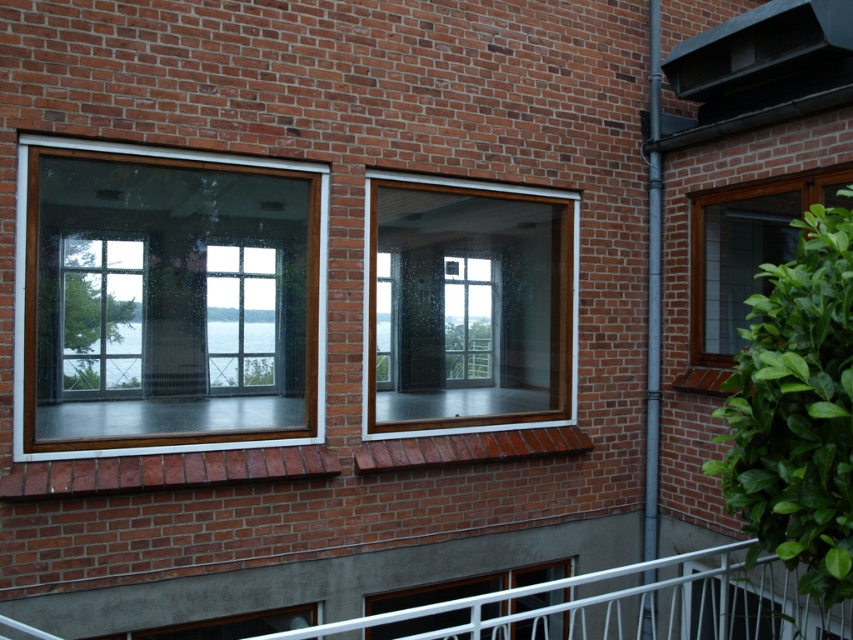
Can you confirm if white metal railing at lower center is thinner than matte brown window at right?

No.

Is white metal railing at lower center smaller than matte brown window at right?

Incorrect, white metal railing at lower center is not smaller in size than matte brown window at right.

The height and width of the screenshot is (640, 853). What do you see at coordinates (619, 605) in the screenshot? I see `white metal railing at lower center` at bounding box center [619, 605].

What are the coordinates of `white metal railing at lower center` in the screenshot? It's located at 619,605.

Who is positioned more to the right, clear glass window at left or matte brown window at right?

From the viewer's perspective, matte brown window at right appears more on the right side.

Does clear glass window at left have a lesser width compared to matte brown window at right?

Correct, clear glass window at left's width is less than matte brown window at right's.

Where is `clear glass window at left`? This screenshot has height=640, width=853. clear glass window at left is located at coordinates (161, 298).

Which is in front, point (389, 316) or point (704, 346)?

Positioned in front is point (704, 346).

The height and width of the screenshot is (640, 853). I want to click on clear glass window at center, so click(466, 305).